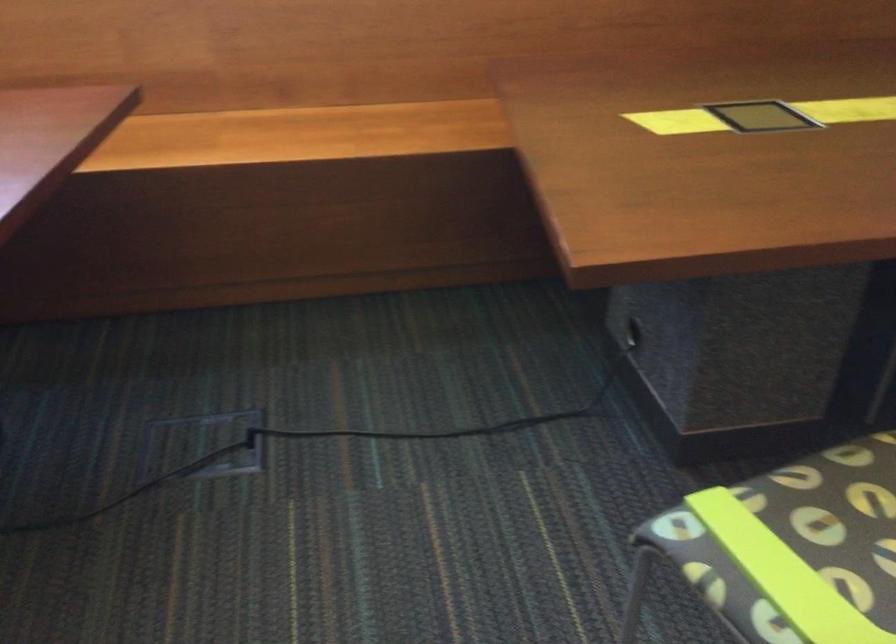
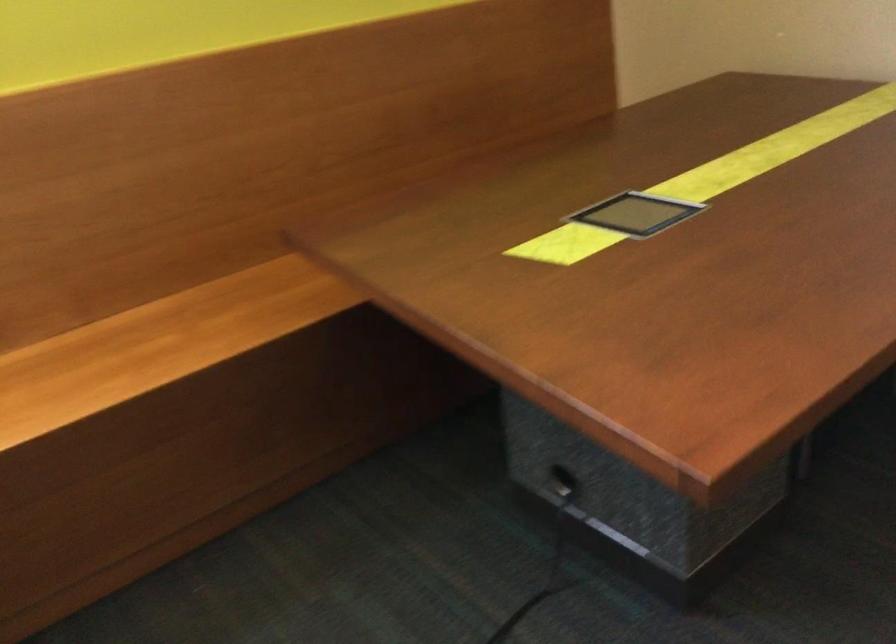
Question: The camera is either moving clockwise (left) or counter-clockwise (right) around the object. The first image is from the beginning of the video and the second image is from the end. Is the camera moving left or right when shooting the video?

Choices:
 (A) Left
 (B) Right

Answer: (A)